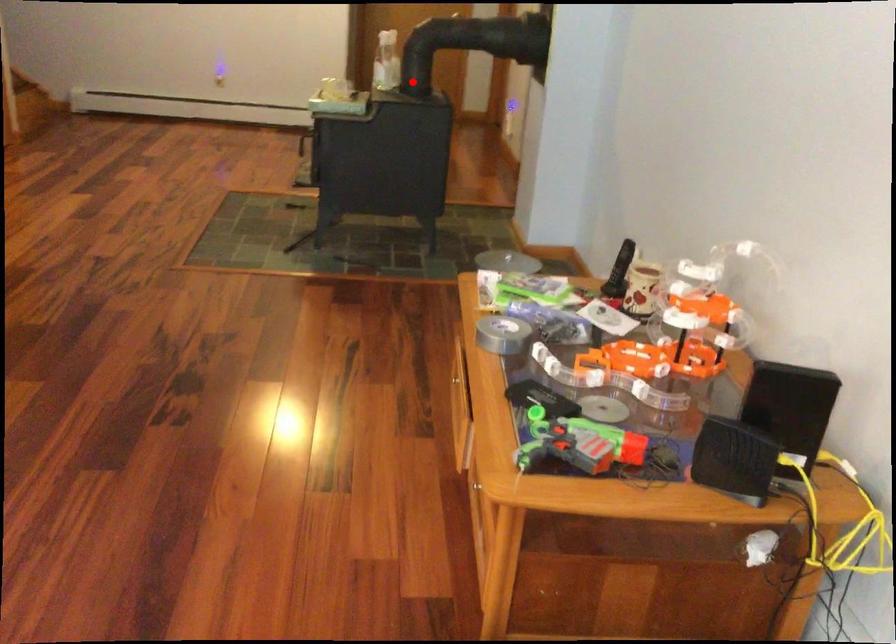
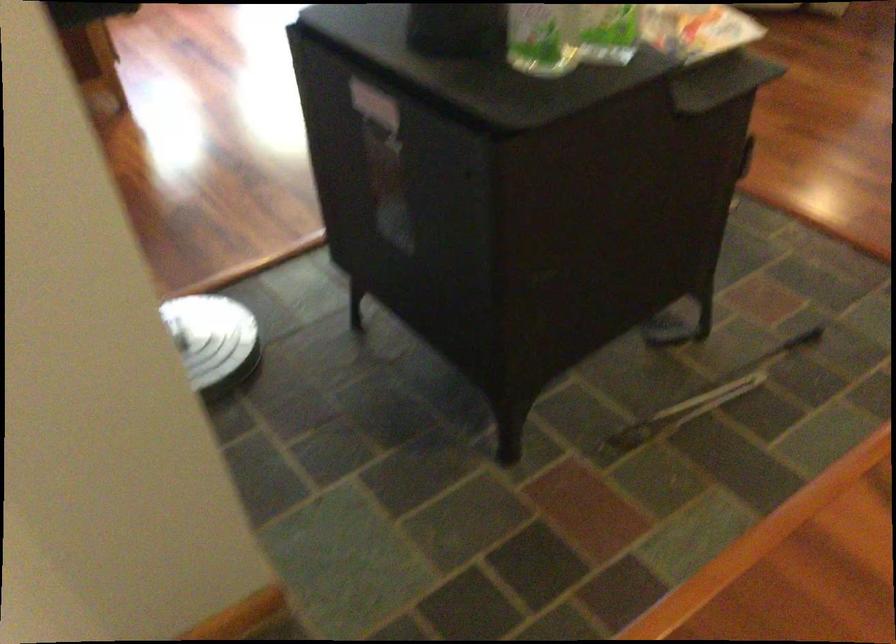
In the second image, find the point that corresponds to the highlighted location in the first image.

(541, 38)